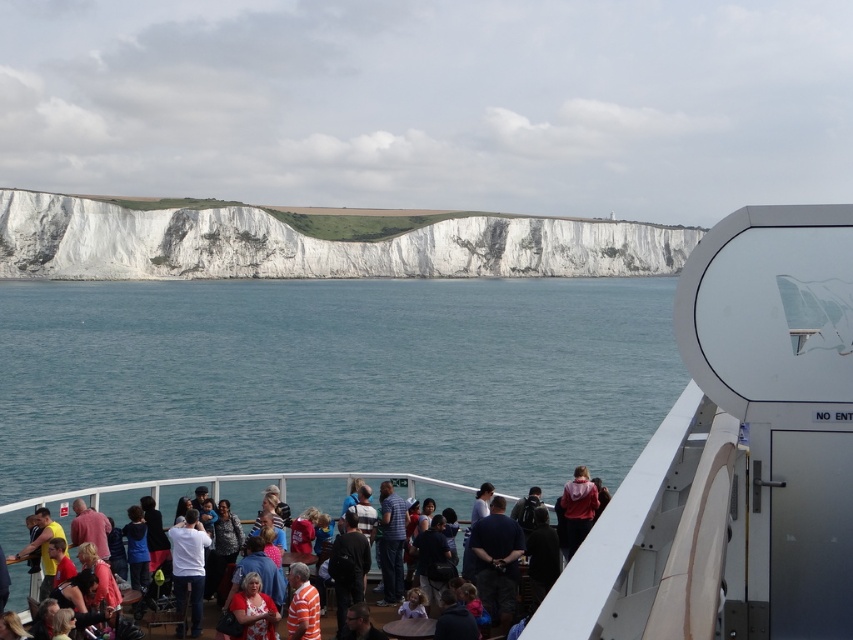
Does white smooth cliff at center have a greater width compared to matte red dress at lower center?

Yes.

Does white smooth cliff at center have a lesser width compared to matte red dress at lower center?

No.

Identify the location of white smooth cliff at center. This screenshot has width=853, height=640. (312, 244).

Is white smooth cliff at center above multicolored casual clothing at center?

Yes, white smooth cliff at center is above multicolored casual clothing at center.

Is white smooth cliff at center positioned at the back of multicolored casual clothing at center?

Yes, white smooth cliff at center is behind multicolored casual clothing at center.

Does point (585, 248) come in front of point (544, 504)?

No.

The width and height of the screenshot is (853, 640). I want to click on white smooth cliff at center, so click(312, 244).

Between white smooth cliff at center and red hoodie at center, which one appears on the right side from the viewer's perspective?

white smooth cliff at center

Does white smooth cliff at center have a greater height compared to red hoodie at center?

Yes.

Which is behind, point (125, 243) or point (564, 512)?

The point (125, 243) is behind.

Locate an element on the screen. white smooth cliff at center is located at coordinates (312, 244).